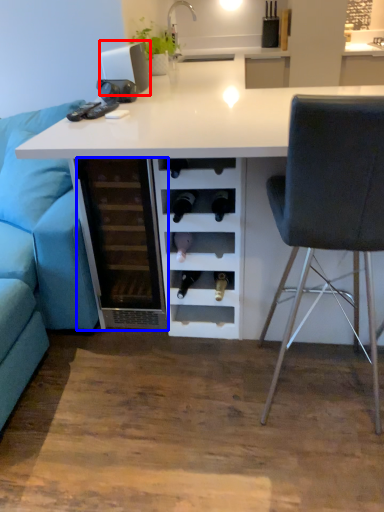
Question: Which of the following is the farthest to the observer, appliance (highlighted by a red box) or file cabinet (highlighted by a blue box)?

Choices:
 (A) appliance
 (B) file cabinet

Answer: (A)